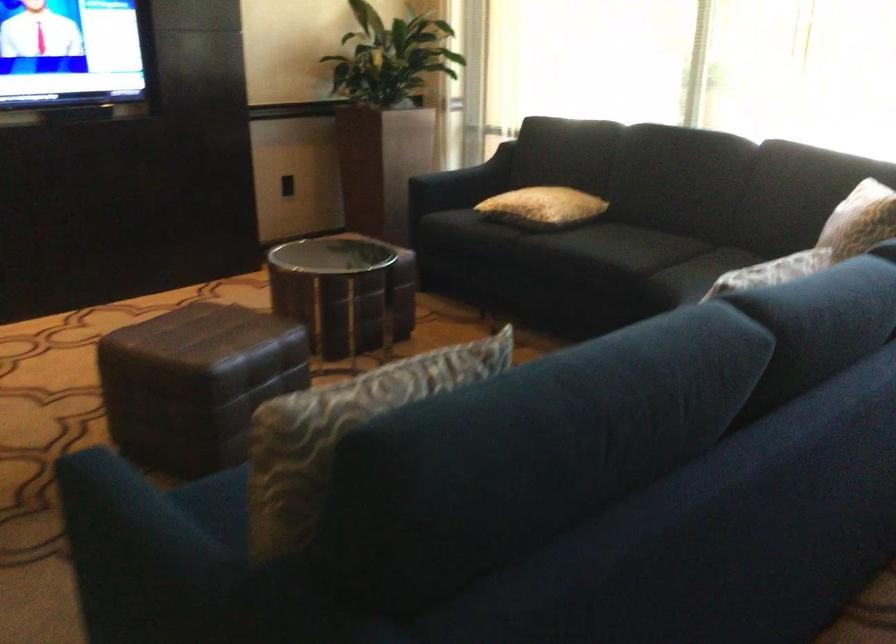
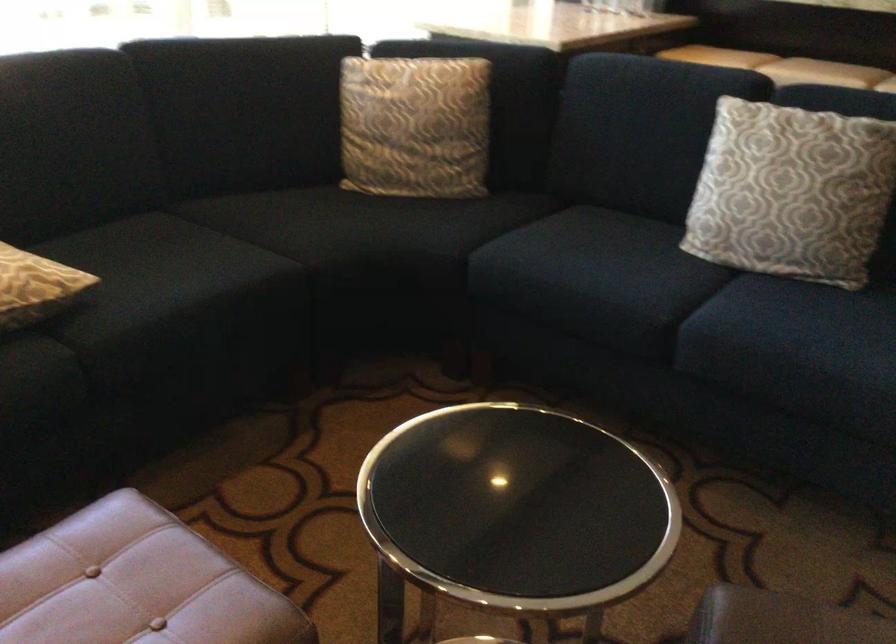
Locate, in the second image, the point that corresponds to point 536,210 in the first image.

(35, 287)